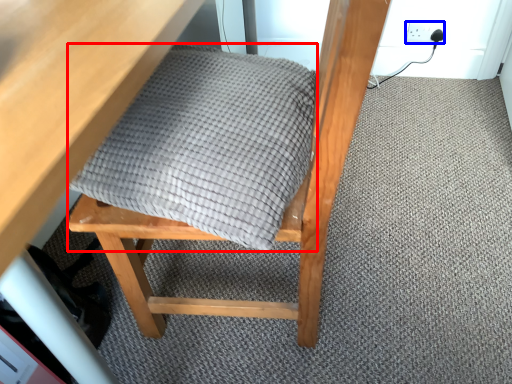
Question: Which object appears closest to the camera in this image, blanket (highlighted by a red box) or electric outlet (highlighted by a blue box)?

Choices:
 (A) blanket
 (B) electric outlet

Answer: (A)